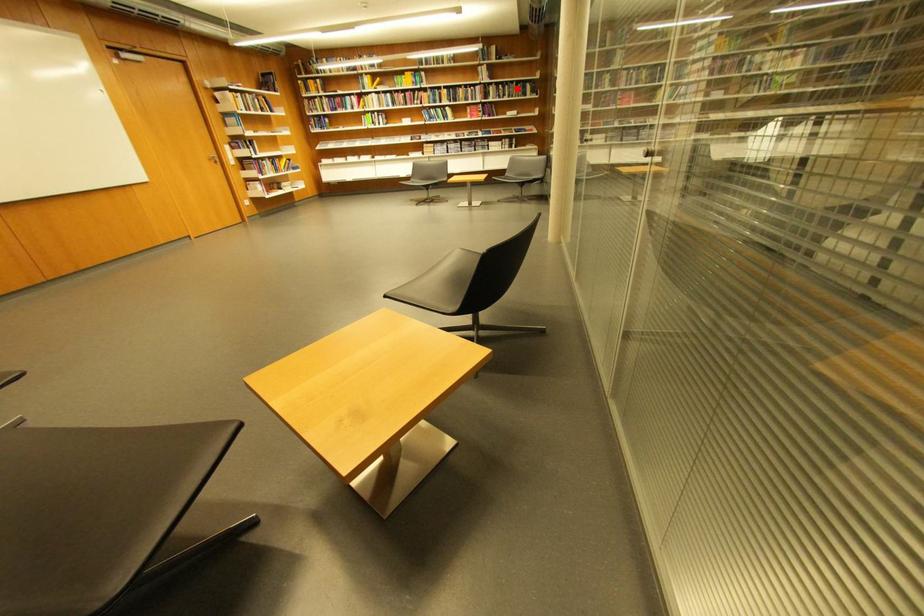
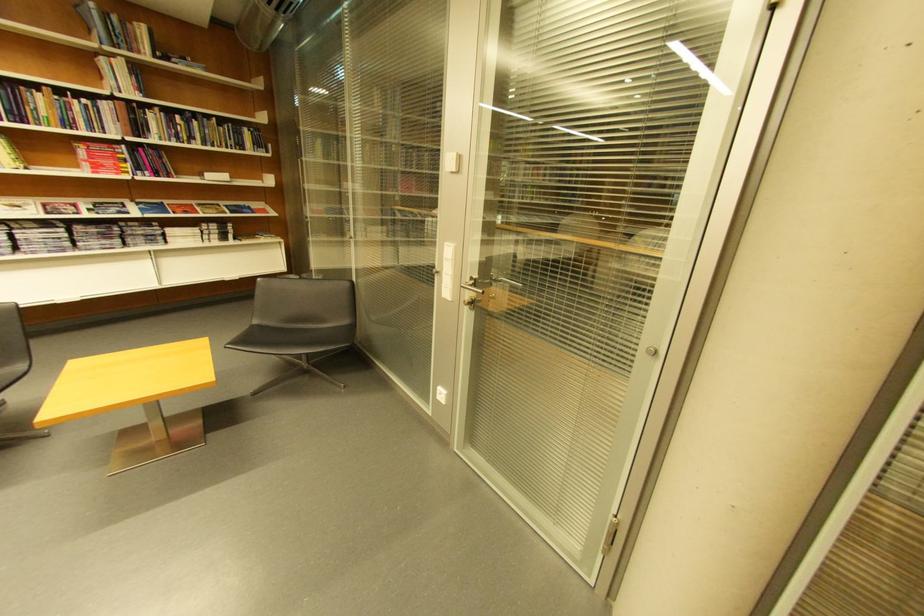
Find the pixel in the second image that matches the highlighted location in the first image.

(205, 124)